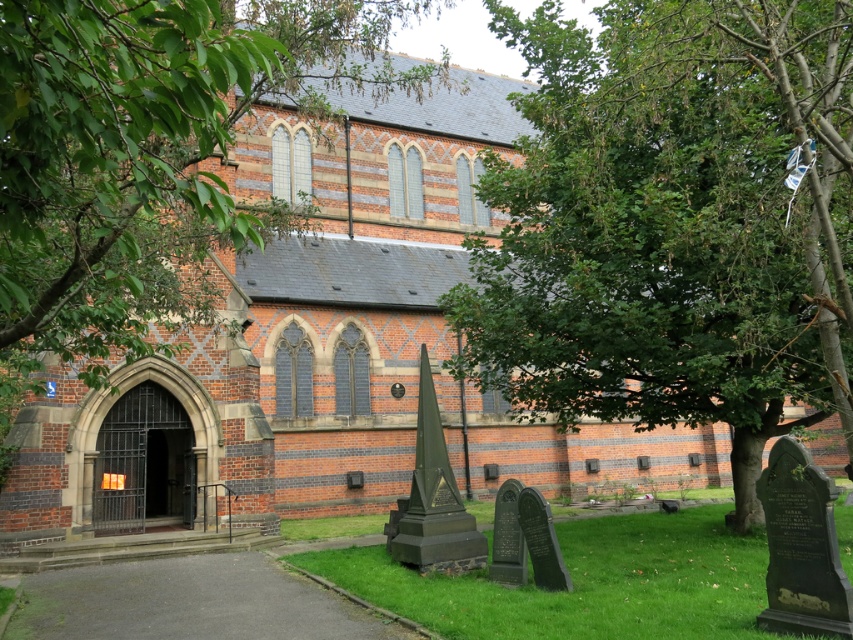
Is point (624, 250) closer to camera compared to point (48, 346)?

No, it is not.

Is green leafy tree at center behind green leafy tree at upper left?

Yes.

Is point (607, 99) more distant than point (0, 285)?

Yes.

The image size is (853, 640). What are the coordinates of `green leafy tree at center` in the screenshot? It's located at (663, 225).

The image size is (853, 640). What do you see at coordinates (663, 225) in the screenshot?
I see `green leafy tree at center` at bounding box center [663, 225].

In the scene shown: Can you confirm if green leafy tree at center is bigger than green grass at center?

Indeed, green leafy tree at center has a larger size compared to green grass at center.

Does point (682, 161) come in front of point (538, 611)?

No, (682, 161) is behind (538, 611).

Where is `green leafy tree at center`? The width and height of the screenshot is (853, 640). green leafy tree at center is located at coordinates (663, 225).

Image resolution: width=853 pixels, height=640 pixels. What do you see at coordinates (151, 156) in the screenshot?
I see `green leafy tree at upper left` at bounding box center [151, 156].

Between green leafy tree at upper left and green grass at center, which one is positioned lower?

Positioned lower is green grass at center.

At what (x,y) coordinates should I click in order to perform the action: click on green leafy tree at upper left. Please return your answer as a coordinate pair (x, y). This screenshot has height=640, width=853. Looking at the image, I should click on (151, 156).

The height and width of the screenshot is (640, 853). In order to click on green leafy tree at upper left in this screenshot , I will do `click(151, 156)`.